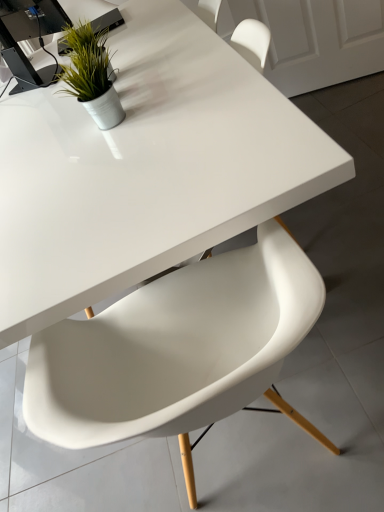
Identify the location of free space that is to the left of green matte plant at upper left. (51, 109).